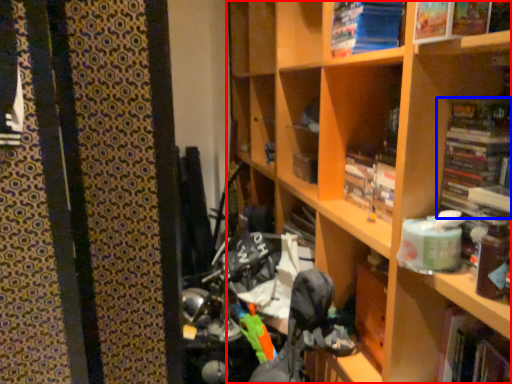
Question: Which object appears closest to the camera in this image, shelf (highlighted by a red box) or book (highlighted by a blue box)?

Choices:
 (A) shelf
 (B) book

Answer: (A)